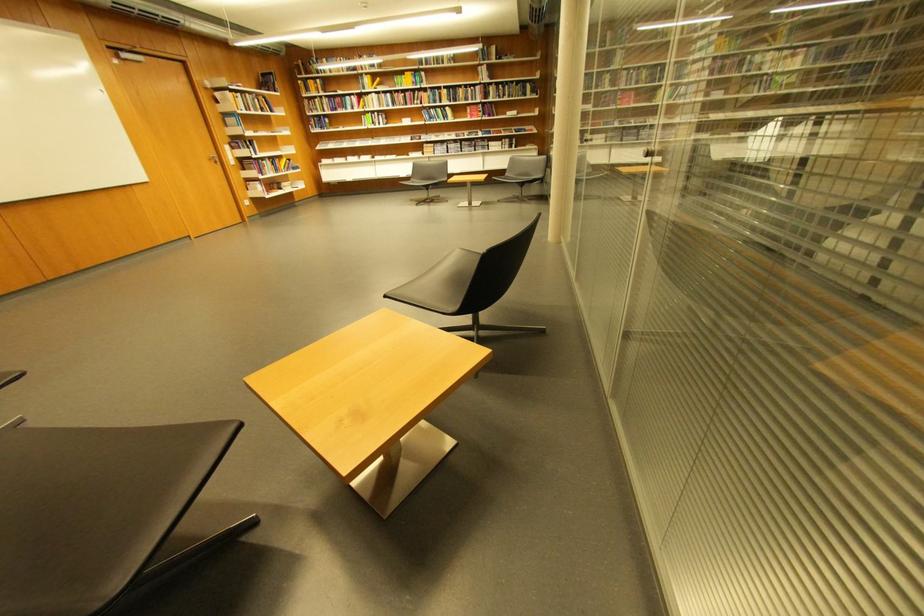
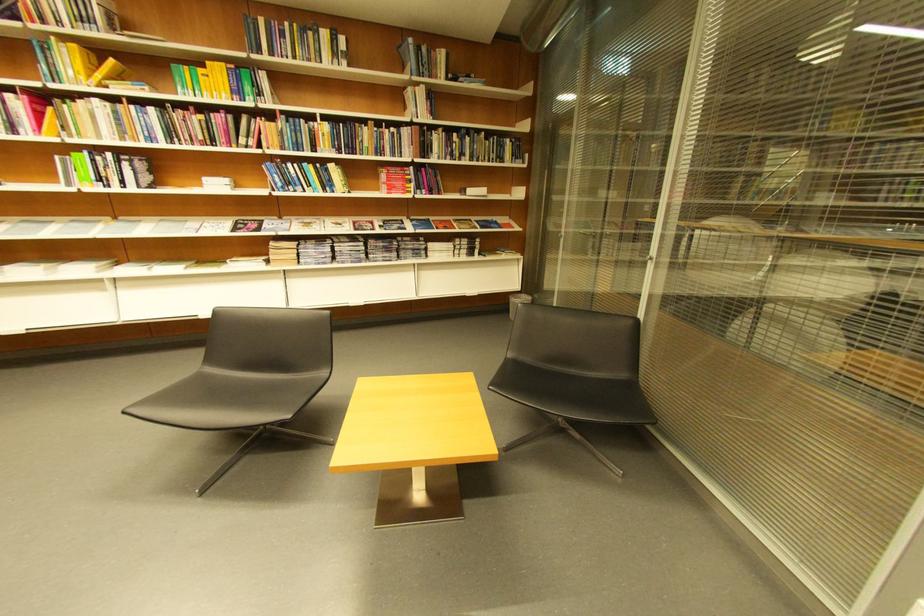
The point at (482,90) is marked in the first image. Where is the corresponding point in the second image?

(403, 131)